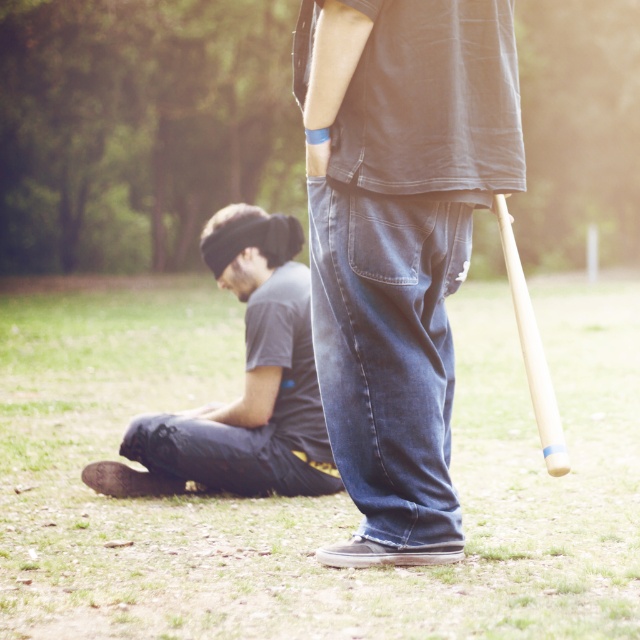
You are standing in the park and want to throw a ball to one of the two points marked in the image. The first point is at coordinates point (328, 538) and the second point is at point (525, 358). Which point is closer to you?

Point (328, 538) is closer to you because it is further to the camera than point (525, 358).

You are a photographer standing in the park and want to take a photo of the dark gray cotton shirt at lower left without the wooden baseball bat at right appearing in the frame. Is this possible based on their positions?

The wooden baseball bat at right is behind the dark gray cotton shirt at lower left, so the photographer can position themselves so that the dark gray cotton shirt at lower left blocks the view of the wooden baseball bat at right, making it possible to take a photo without the bat in the frame.